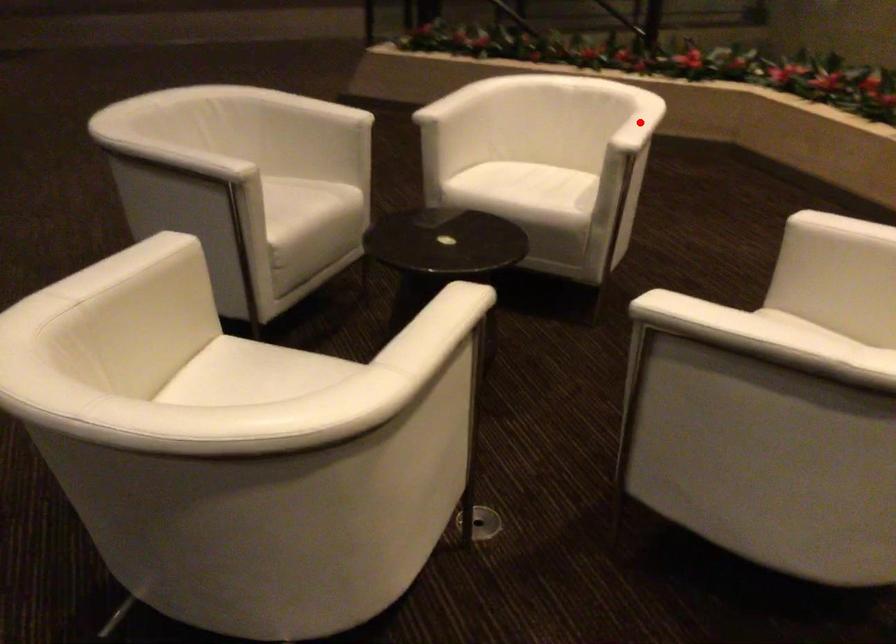
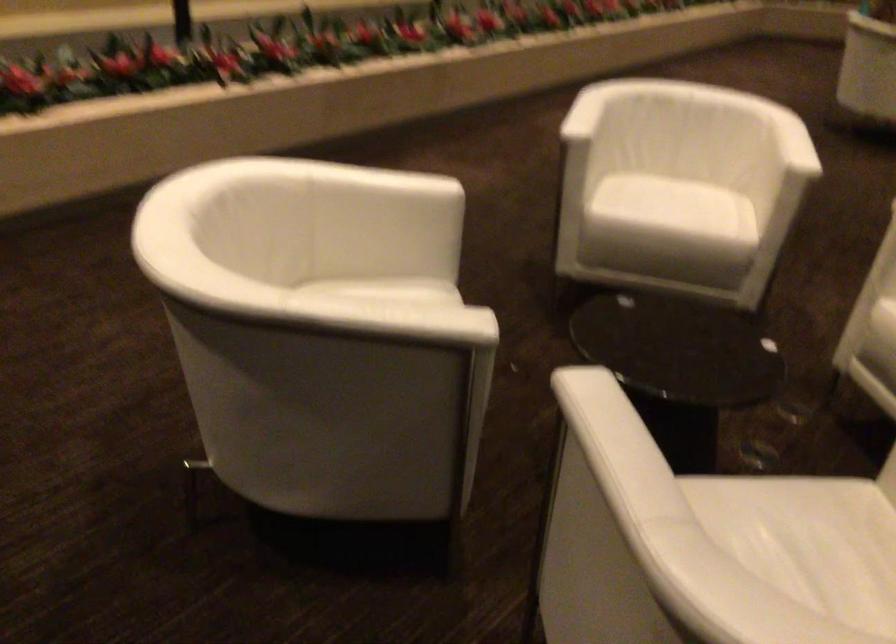
Question: I am providing you with two images of the same scene from different viewpoints. A red point is marked on the first image. Is the red point's position out of view in image 2?

Choices:
 (A) Yes
 (B) No

Answer: (A)